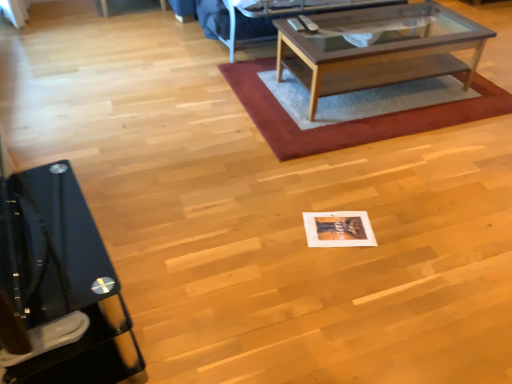
Question: Considering the positions of rug with woven texture at center and black glossy desk at left in the image, is rug with woven texture at center bigger or smaller than black glossy desk at left?

Choices:
 (A) small
 (B) big

Answer: (B)

Question: From the image's perspective, relative to black glossy desk at left, is rug with woven texture at center above or below?

Choices:
 (A) above
 (B) below

Answer: (A)

Question: Considering the real-world distances, which object is closest to the black glossy desk at left?

Choices:
 (A) rug with woven texture at center
 (B) wooden glass coffee table at center

Answer: (A)

Question: Estimate the real-world distances between objects in this image. Which object is farther from the black glossy desk at left?

Choices:
 (A) wooden glass coffee table at center
 (B) rug with woven texture at center

Answer: (A)